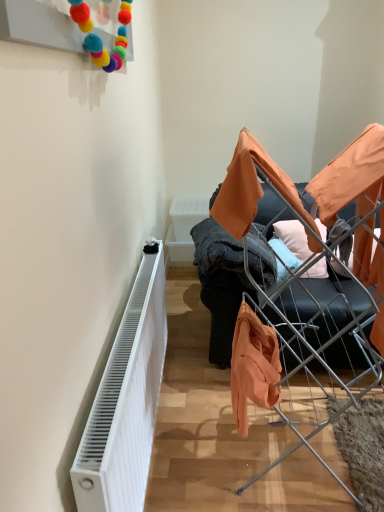
Question: From the image's perspective, is orange fabric couch at center located above orange fabric at center?

Choices:
 (A) no
 (B) yes

Answer: (B)

Question: From the image's perspective, is orange fabric couch at center below orange fabric at center?

Choices:
 (A) yes
 (B) no

Answer: (B)

Question: Are orange fabric couch at center and orange fabric at center far apart?

Choices:
 (A) no
 (B) yes

Answer: (A)

Question: Can you confirm if orange fabric couch at center is taller than orange fabric at center?

Choices:
 (A) yes
 (B) no

Answer: (B)

Question: Does orange fabric couch at center have a lesser width compared to orange fabric at center?

Choices:
 (A) no
 (B) yes

Answer: (A)

Question: Is orange fabric couch at center taller or shorter than white ribbed radiator at lower left?

Choices:
 (A) tall
 (B) short

Answer: (A)

Question: Which is correct: orange fabric couch at center is inside white ribbed radiator at lower left, or outside of it?

Choices:
 (A) outside
 (B) inside

Answer: (A)

Question: Considering the positions of orange fabric couch at center and white ribbed radiator at lower left in the image, is orange fabric couch at center bigger or smaller than white ribbed radiator at lower left?

Choices:
 (A) big
 (B) small

Answer: (A)

Question: From the image's perspective, is orange fabric couch at center above or below white ribbed radiator at lower left?

Choices:
 (A) below
 (B) above

Answer: (B)

Question: Is white ribbed radiator at lower left bigger or smaller than soft cotton pillow at center?

Choices:
 (A) big
 (B) small

Answer: (A)

Question: Is point [135, 415] positioned closer to the camera than point [296, 223]?

Choices:
 (A) farther
 (B) closer

Answer: (B)

Question: In terms of width, does white ribbed radiator at lower left look wider or thinner when compared to soft cotton pillow at center?

Choices:
 (A) wide
 (B) thin

Answer: (B)

Question: From the image's perspective, is white ribbed radiator at lower left located above or below soft cotton pillow at center?

Choices:
 (A) above
 (B) below

Answer: (B)

Question: Relative to white ribbed radiator at lower left, is soft cotton pillow at center in front or behind?

Choices:
 (A) behind
 (B) front

Answer: (A)

Question: Is soft cotton pillow at center to the left or to the right of white ribbed radiator at lower left in the image?

Choices:
 (A) right
 (B) left

Answer: (A)